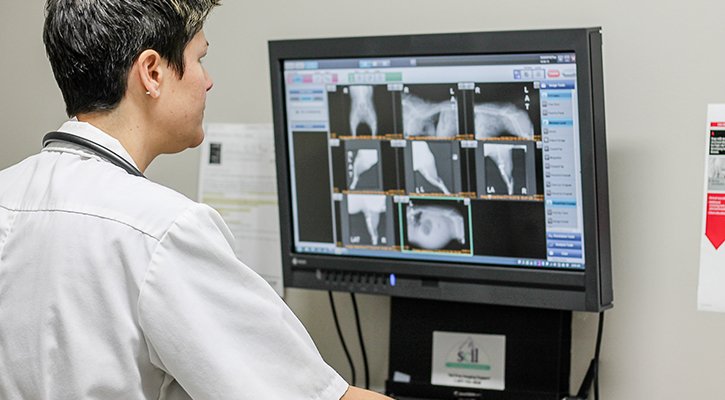
Identify the location of computer monitor. Image resolution: width=725 pixels, height=400 pixels. (396, 152).